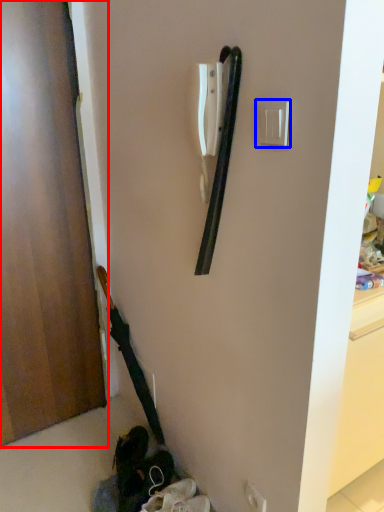
Question: Which object is further to the camera taking this photo, door (highlighted by a red box) or light switch (highlighted by a blue box)?

Choices:
 (A) door
 (B) light switch

Answer: (A)